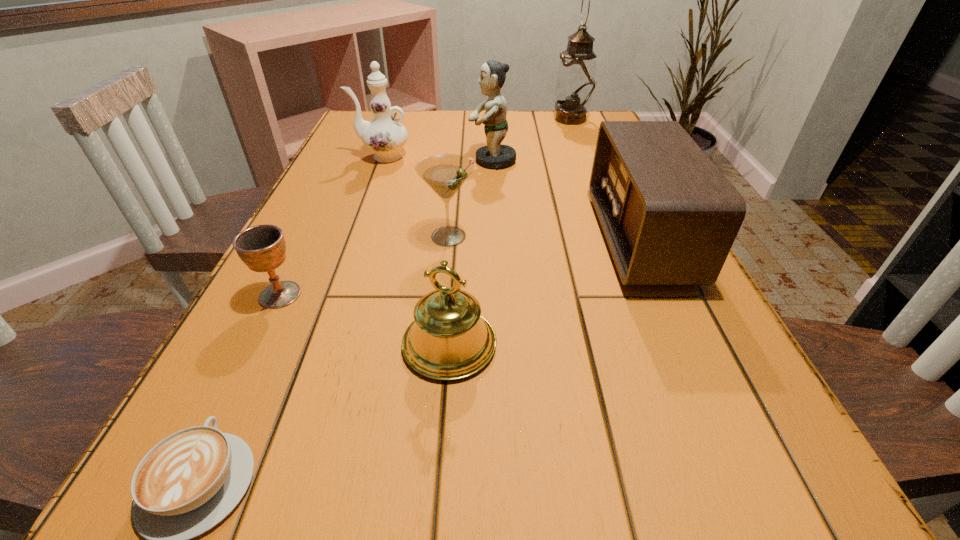
At what (x,y) coordinates should I click in order to perform the action: click on the tallest object. Please return your answer as a coordinate pair (x, y). The width and height of the screenshot is (960, 540). Looking at the image, I should click on (576, 82).

Identify the location of the farthest object. (576, 82).

You are a GUI agent. You are given a task and a screenshot of the screen. Output one action in this format:
    pyautogui.click(x=<x>, y=<y>)
    Task: Click on the figurine
    This screenshot has width=960, height=540.
    Given the screenshot: What is the action you would take?
    pyautogui.click(x=492, y=77)

Identify the location of chinaware. (385, 136).

Where is `radio receiver`? Image resolution: width=960 pixels, height=540 pixels. radio receiver is located at coordinates (670, 217).

This screenshot has height=540, width=960. I want to click on martini, so click(x=444, y=173).

Find the location of a particular element. The image size is (960, 540). bell is located at coordinates (448, 340).

Find the location of a particular element. The width and height of the screenshot is (960, 540). chalice is located at coordinates (262, 248).

Identify the location of free region located 0.120m on the front of the oil lamp. (581, 145).

Locate an element on the screen. The image size is (960, 540). free region located 0.110m on the front-facing side of the figurine is located at coordinates (427, 160).